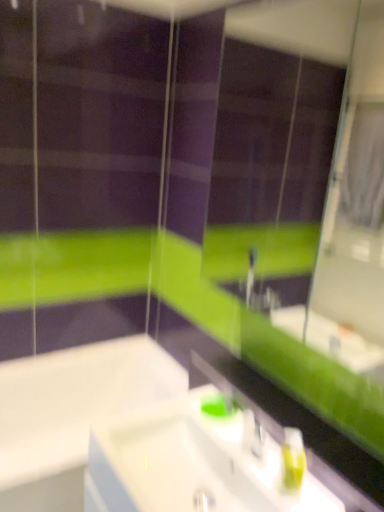
At what (x,y) coordinates should I click in order to perform the action: click on green matte soap dispenser at lower right. Please return your answer as a coordinate pair (x, y). Looking at the image, I should click on tap(293, 459).

This screenshot has height=512, width=384. I want to click on green matte soap dispenser at lower right, so click(293, 459).

Is white glossy bathtub at lower left far from white glossy sink at center?

No, white glossy bathtub at lower left is in close proximity to white glossy sink at center.

Locate an element on the screen. sink that appears in front of the white glossy bathtub at lower left is located at coordinates (192, 464).

Considering the positions of objects white glossy bathtub at lower left and white glossy sink at center in the image provided, who is more to the left, white glossy bathtub at lower left or white glossy sink at center?

white glossy bathtub at lower left is more to the left.

Is point (29, 462) behind point (281, 476)?

Yes.

In the scene shown: Is white glossy bathtub at lower left far from green matte mirror at upper center?

white glossy bathtub at lower left is positioned a significant distance from green matte mirror at upper center.

In the image, is white glossy bathtub at lower left positioned in front of or behind green matte mirror at upper center?

white glossy bathtub at lower left is positioned farther from the viewer than green matte mirror at upper center.

Is white glossy bathtub at lower left situated inside green matte mirror at upper center or outside?

white glossy bathtub at lower left is not inside green matte mirror at upper center, it's outside.

Is white glossy bathtub at lower left smaller than green matte mirror at upper center?

No.

Is white glossy bathtub at lower left oriented towards green matte soap dispenser at lower right?

No, white glossy bathtub at lower left does not turn towards green matte soap dispenser at lower right.

From the image's perspective, which is below, white glossy bathtub at lower left or green matte soap dispenser at lower right?

white glossy bathtub at lower left is shown below in the image.

Can you confirm if white glossy bathtub at lower left is thinner than green matte soap dispenser at lower right?

No, white glossy bathtub at lower left is not thinner than green matte soap dispenser at lower right.

Does point (158, 354) come in front of point (288, 472)?

No, it is behind (288, 472).

From the image's perspective, relative to green matte soap dispenser at lower right, is white glossy sink at center above or below?

white glossy sink at center is situated lower than green matte soap dispenser at lower right in the image.

The height and width of the screenshot is (512, 384). I want to click on soap dispenser lying behind the white glossy sink at center, so click(293, 459).

Who is bigger, white glossy sink at center or green matte soap dispenser at lower right?

white glossy sink at center is bigger.

Based on the photo, considering the relative sizes of green matte mirror at upper center and green matte soap dispenser at lower right in the image provided, is green matte mirror at upper center thinner than green matte soap dispenser at lower right?

Incorrect, the width of green matte mirror at upper center is not less than that of green matte soap dispenser at lower right.

Would you say green matte soap dispenser at lower right is part of green matte mirror at upper center's contents?

No, green matte soap dispenser at lower right is not surrounded by green matte mirror at upper center.

From a real-world perspective, is green matte mirror at upper center below green matte soap dispenser at lower right?

No, from a real-world perspective, green matte mirror at upper center is not under green matte soap dispenser at lower right.

From the image's perspective, between green matte mirror at upper center and green matte soap dispenser at lower right, who is located below?

From the image's view, green matte soap dispenser at lower right is below.

Locate an element on the screen. mirror on the right of white glossy bathtub at lower left is located at coordinates (305, 239).

Based on the photo, who is taller, green matte mirror at upper center or white glossy bathtub at lower left?

green matte mirror at upper center is taller.

Is white glossy bathtub at lower left a part of green matte mirror at upper center?

No, white glossy bathtub at lower left is not inside green matte mirror at upper center.

Does point (281, 259) come in front of point (36, 393)?

No.

Is green matte soap dispenser at lower right at the right side of white glossy sink at center?

Yes, green matte soap dispenser at lower right is to the right of white glossy sink at center.

From a real-world perspective, is green matte soap dispenser at lower right above or below white glossy sink at center?

In terms of real-world spatial position, green matte soap dispenser at lower right is above white glossy sink at center.

From the image's perspective, which one is positioned lower, green matte soap dispenser at lower right or white glossy sink at center?

From the image's view, white glossy sink at center is below.

Which object is wider, green matte soap dispenser at lower right or white glossy sink at center?

white glossy sink at center.

Where is `bath on the left of the white glossy sink at center`? This screenshot has height=512, width=384. bath on the left of the white glossy sink at center is located at coordinates (71, 413).

The image size is (384, 512). I want to click on mirror above the white glossy bathtub at lower left (from a real-world perspective), so click(305, 239).

Looking at the image, which one is located further to white glossy sink at center, green matte mirror at upper center or white glossy bathtub at lower left?

The object further to white glossy sink at center is green matte mirror at upper center.

From the image, which object appears to be nearer to white glossy bathtub at lower left, green matte soap dispenser at lower right or green matte mirror at upper center?

green matte mirror at upper center is closer to white glossy bathtub at lower left.

When comparing their distances from white glossy bathtub at lower left, does white glossy sink at center or green matte soap dispenser at lower right seem closer?

white glossy sink at center is positioned closer to the anchor white glossy bathtub at lower left.

When comparing their distances from white glossy sink at center, does green matte mirror at upper center or green matte soap dispenser at lower right seem closer?

Based on the image, green matte soap dispenser at lower right appears to be nearer to white glossy sink at center.

Which object lies further to the anchor point green matte soap dispenser at lower right, white glossy sink at center or green matte mirror at upper center?

Based on the image, green matte mirror at upper center appears to be further to green matte soap dispenser at lower right.

Which object lies nearer to the anchor point green matte soap dispenser at lower right, white glossy bathtub at lower left or green matte mirror at upper center?

Based on the image, white glossy bathtub at lower left appears to be nearer to green matte soap dispenser at lower right.

Which object lies nearer to the anchor point white glossy sink at center, green matte soap dispenser at lower right or white glossy bathtub at lower left?

green matte soap dispenser at lower right is closer to white glossy sink at center.

Looking at the image, which one is located closer to green matte mirror at upper center, white glossy bathtub at lower left or green matte soap dispenser at lower right?

The object closer to green matte mirror at upper center is white glossy bathtub at lower left.

Find the location of `soap dispenser between green matte mirror at upper center and white glossy sink at center in the vertical direction`. soap dispenser between green matte mirror at upper center and white glossy sink at center in the vertical direction is located at coordinates (293, 459).

In order to click on soap dispenser between green matte mirror at upper center and white glossy bathtub at lower left from top to bottom in this screenshot , I will do `click(293, 459)`.

Where is `sink between white glossy bathtub at lower left and green matte soap dispenser at lower right`? This screenshot has width=384, height=512. sink between white glossy bathtub at lower left and green matte soap dispenser at lower right is located at coordinates (192, 464).

Find the location of a particular element. sink that lies between green matte mirror at upper center and white glossy bathtub at lower left from top to bottom is located at coordinates [192, 464].